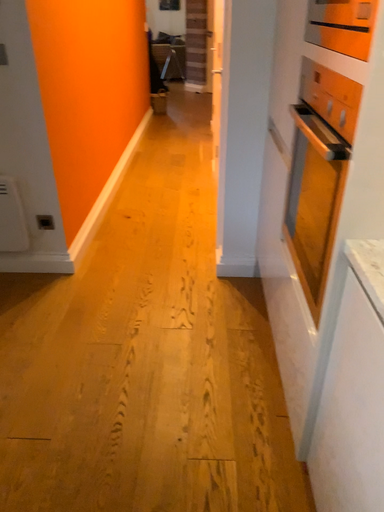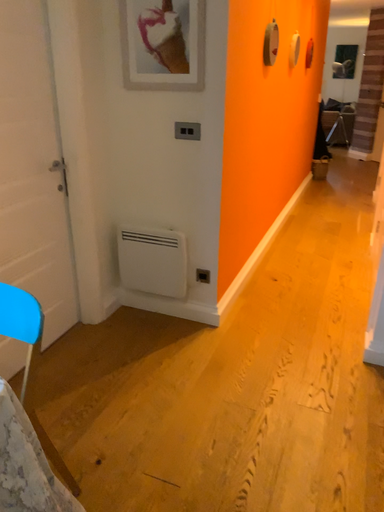
Question: How did the camera likely rotate when shooting the video?

Choices:
 (A) rotated right
 (B) rotated left

Answer: (B)